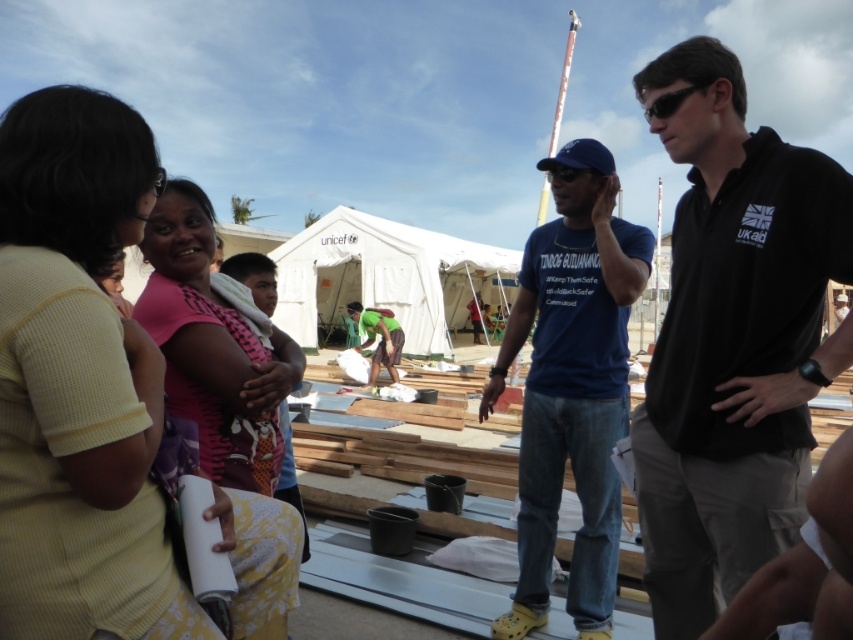
You are a photographer at the construction site. You want to take a photo that includes both the blue cotton shirt at center and the green fabric shirt at center. Which one should you focus on first to ensure both are in frame?

The blue cotton shirt at center is much taller than the green fabric shirt at center, so you should focus on the blue cotton shirt at center first to ensure both are in frame.

From the picture: You are a photographer at the construction site. You want to take a photo that includes both point (276, 500) and point (376, 365). Which point will appear larger in the photo?

Point (276, 500) is closer to the camera than point (376, 365), so it will appear larger in the photo.

You are standing at the point marked by the coordinates point (x=96, y=150). You want to hand over a document to the man in the black polo shirt with UK Aid on the sleeve. Can you reach him without moving from your current position?

The distance between you and the man in the black polo shirt with UK Aid on the sleeve is 4.67 feet. Since this distance is greater than an average person arm length, you cannot reach him without moving from your current position.